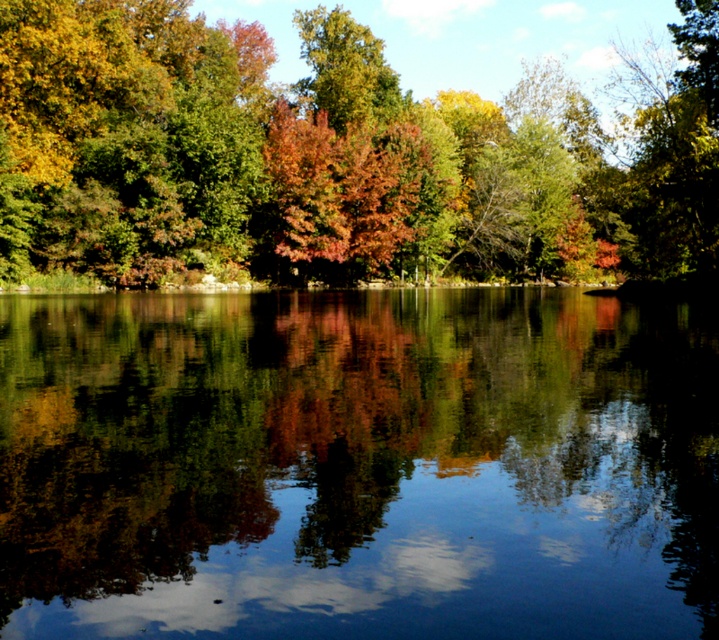
In the scene shown: You are standing at the edge of the water and want to place a small decorative stone on the transparent glass water at center. Can you do this without breaking the surface?

The transparent glass water at center is water, so placing a stone on it would break the surface as water cannot support the stone.

Based on the photo, you are an artist trying to paint the scene. You have a canvas that can only fit objects of a certain width. If you want to include both the transparent glass water at center and the shiny red leaves at center, which object should you prioritize to ensure it fits properly?

→ The transparent glass water at center has a greater width than the shiny red leaves at center, so you should prioritize including the transparent glass water at center to ensure it fits properly on the canvas.

You are standing at the edge of the water in the scene. You notice a point labeled as point (357, 465) in the center. What is the object at this point?

The point (357, 465) marks transparent glass water at center.